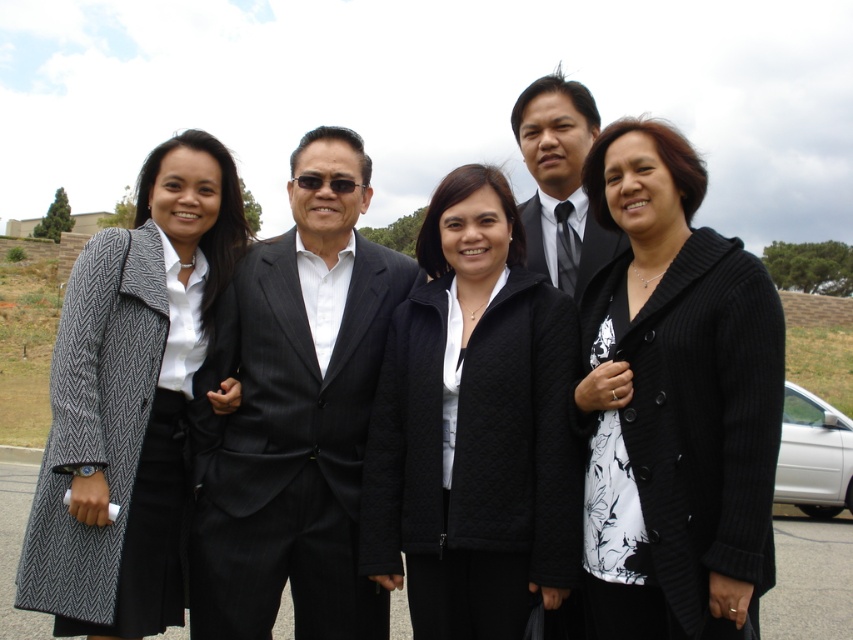
Question: Considering the real-world distances, which object is farthest from the black pinstripe suit at center?

Choices:
 (A) gray herringbone coat at left
 (B) silver metallic car at lower right

Answer: (B)

Question: Can you confirm if gray herringbone coat at left is bigger than black pinstripe suit at center?

Choices:
 (A) no
 (B) yes

Answer: (B)

Question: Which object appears farthest from the camera in this image?

Choices:
 (A) gray herringbone coat at left
 (B) silver metallic car at lower right
 (C) black ribbed cardigan at center
 (D) matte black suit at center

Answer: (B)

Question: Considering the relative positions of black ribbed cardigan at center and gray herringbone coat at left in the image provided, where is black ribbed cardigan at center located with respect to gray herringbone coat at left?

Choices:
 (A) left
 (B) right

Answer: (B)

Question: Is black ribbed cardigan at center wider than gray herringbone coat at left?

Choices:
 (A) no
 (B) yes

Answer: (A)

Question: Among these points, which one is farthest from the camera?

Choices:
 (A) (492, 275)
 (B) (532, 218)
 (C) (520, 218)
 (D) (785, 492)

Answer: (D)